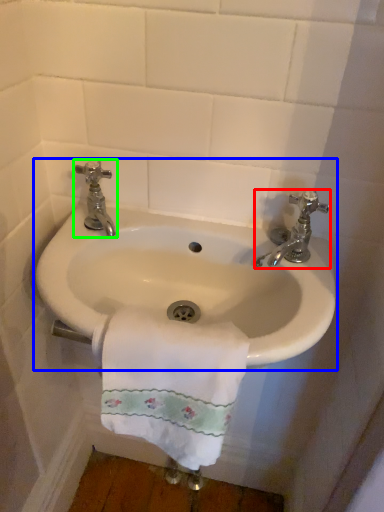
Question: Estimate the real-world distances between objects in this image. Which object is closer to tap (highlighted by a red box), sink (highlighted by a blue box) or tap (highlighted by a green box)?

Choices:
 (A) sink
 (B) tap

Answer: (A)